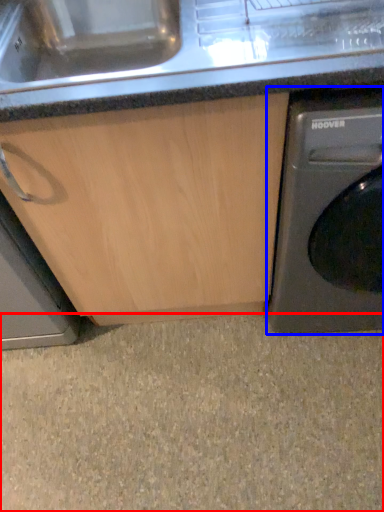
Question: Which object appears farthest to the camera in this image, granite (highlighted by a red box) or washing machine (highlighted by a blue box)?

Choices:
 (A) granite
 (B) washing machine

Answer: (A)